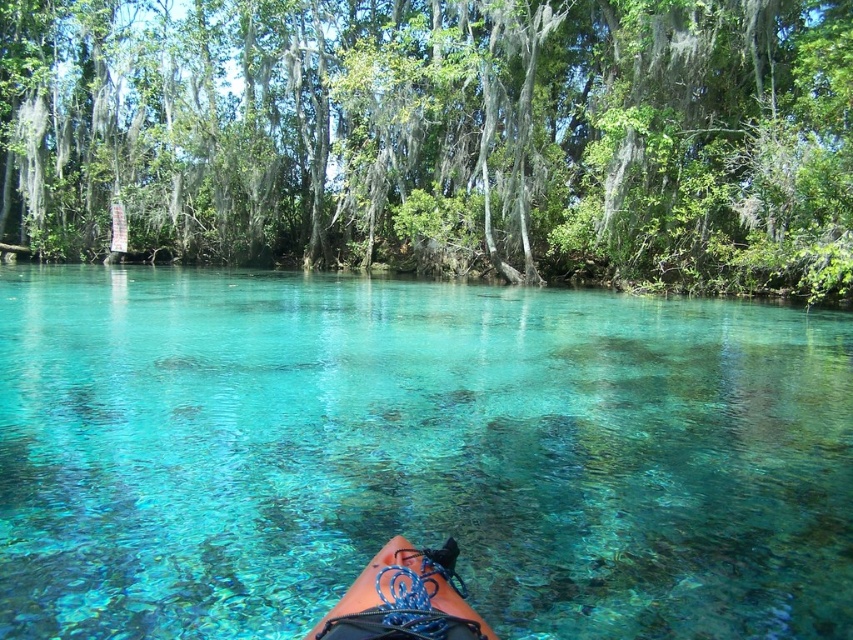
You are standing on the shore of the lake and see the clear glassy water at center and the blue rubber canoe at lower center. Which object is closer to you?

The blue rubber canoe at lower center is closer to you because the clear glassy water at center is further away.

You are planning to take a photo of the clear glassy water at center and the green leafy tree at upper center. Which object will appear smaller in the photo?

The clear glassy water at center will appear smaller in the photo because it is not as tall as the green leafy tree at upper center.

You are standing on the bank of the lake and see the green leafy tree at upper center and the blue rubber canoe at lower center. Which object is higher in the image?

The green leafy tree at upper center is higher in the image because it is positioned above the blue rubber canoe at lower center.